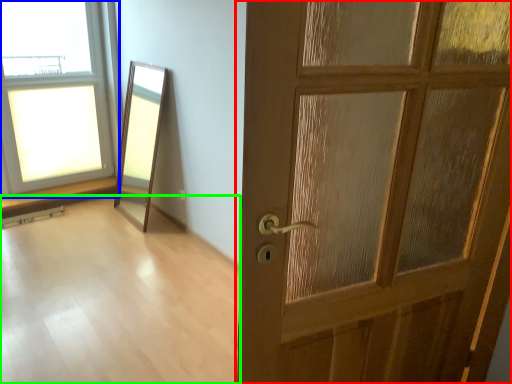
Question: Estimate the real-world distances between objects in this image. Which object is farther from door (highlighted by a red box), window (highlighted by a blue box) or corridor (highlighted by a green box)?

Choices:
 (A) window
 (B) corridor

Answer: (A)